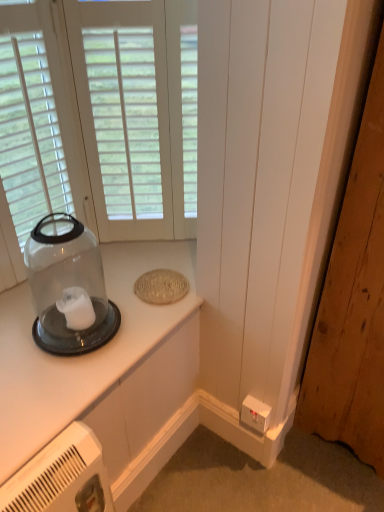
At what (x,y) coordinates should I click in order to perform the action: click on vacant space to the left of transparent glass jar at left. Please return your answer as a coordinate pair (x, y). Looking at the image, I should click on (20, 318).